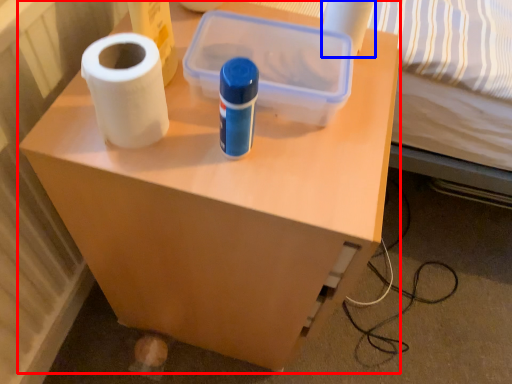
Question: Which object is closer to the camera taking this photo, furniture (highlighted by a red box) or toilet paper (highlighted by a blue box)?

Choices:
 (A) furniture
 (B) toilet paper

Answer: (A)